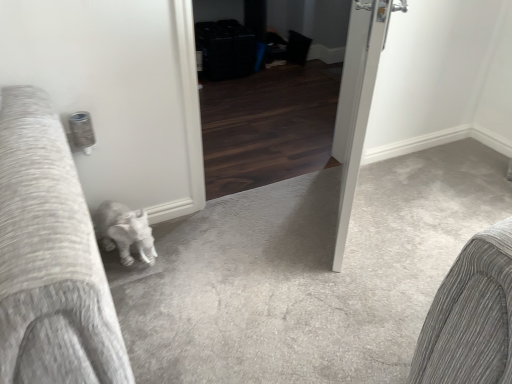
Question: From a real-world perspective, relative to dark wood screen door at center, is white glossy door at center vertically above or below?

Choices:
 (A) above
 (B) below

Answer: (A)

Question: Is white glossy door at center wider or thinner than dark wood screen door at center?

Choices:
 (A) wide
 (B) thin

Answer: (B)

Question: Is white glossy door at center bigger or smaller than dark wood screen door at center?

Choices:
 (A) small
 (B) big

Answer: (A)

Question: Relative to white glossy door at center, is dark wood screen door at center in front or behind?

Choices:
 (A) behind
 (B) front

Answer: (A)

Question: From a real-world perspective, is dark wood screen door at center physically located above or below white glossy door at center?

Choices:
 (A) above
 (B) below

Answer: (B)

Question: Based on their sizes in the image, would you say dark wood screen door at center is bigger or smaller than white glossy door at center?

Choices:
 (A) small
 (B) big

Answer: (B)

Question: Is point coord(315,24) positioned closer to the camera than point coord(345,175)?

Choices:
 (A) farther
 (B) closer

Answer: (A)